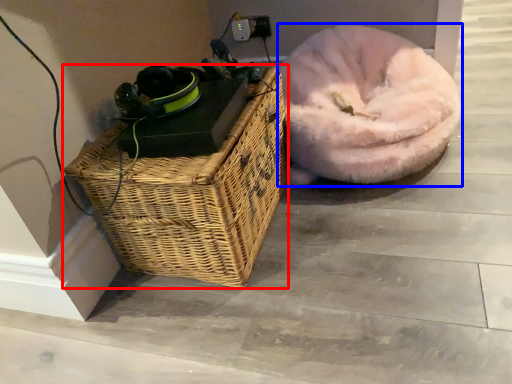
Question: Which object is further to the camera taking this photo, picnic basket (highlighted by a red box) or dog bed (highlighted by a blue box)?

Choices:
 (A) picnic basket
 (B) dog bed

Answer: (B)